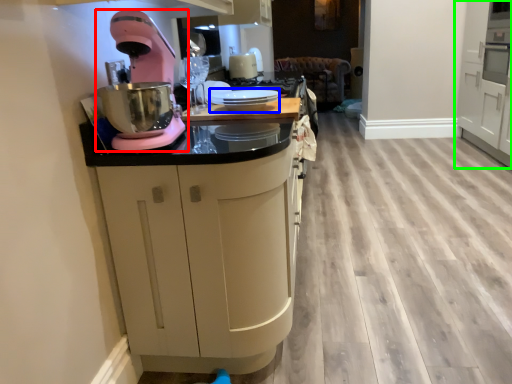
Question: Which object is the farthest from home appliance (highlighted by a red box)? Choose among these: appliance (highlighted by a blue box) or cabinetry (highlighted by a green box).

Choices:
 (A) appliance
 (B) cabinetry

Answer: (B)